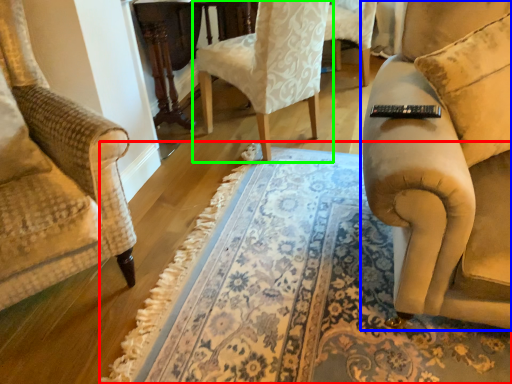
Question: Estimate the real-world distances between objects in this image. Which object is closer to mat (highlighted by a red box), studio couch (highlighted by a blue box) or chair (highlighted by a green box)?

Choices:
 (A) studio couch
 (B) chair

Answer: (A)